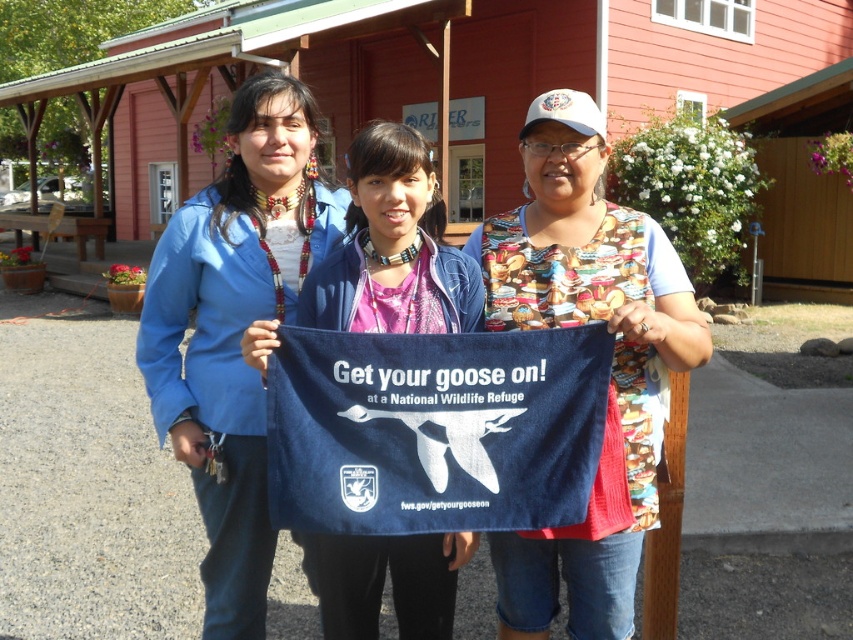
Question: Is navy blue towel at center thinner than blue fabric bag at center?

Choices:
 (A) no
 (B) yes

Answer: (A)

Question: Is navy blue towel at center positioned behind blue fabric bag at center?

Choices:
 (A) no
 (B) yes

Answer: (A)

Question: Does printed fabric apron at center have a larger size compared to blue fabric bag at center?

Choices:
 (A) no
 (B) yes

Answer: (B)

Question: Which point is farther to the camera?

Choices:
 (A) printed fabric apron at center
 (B) blue fabric bag at center

Answer: (B)

Question: Which point is closer to the camera?

Choices:
 (A) navy blue towel at center
 (B) blue fabric bag at center

Answer: (A)

Question: Considering the real-world distances, which object is farthest from the printed fabric apron at center?

Choices:
 (A) navy blue towel at center
 (B) blue fabric bag at center

Answer: (B)